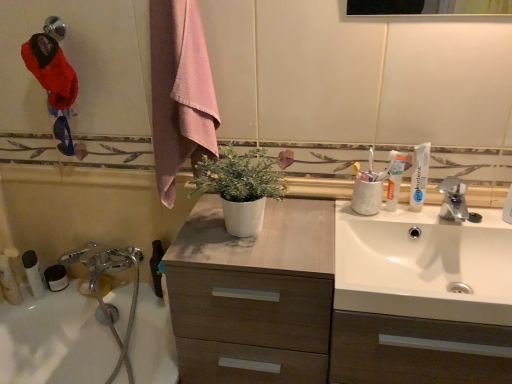
Question: Considering the relative positions of white matte tube of toothpaste at upper right, positioned as the third toothpaste in left-to-right order, and white matte toothpaste at upper right, the second toothpaste viewed from the left, in the image provided, is white matte tube of toothpaste at upper right, positioned as the third toothpaste in left-to-right order, to the right of white matte toothpaste at upper right, the second toothpaste viewed from the left, from the viewer's perspective?

Choices:
 (A) no
 (B) yes

Answer: (B)

Question: Is white matte toothpaste at upper right, the second toothpaste viewed from the left, at the back of white matte tube of toothpaste at upper right, the first toothpaste when ordered from right to left?

Choices:
 (A) no
 (B) yes

Answer: (A)

Question: From the image's perspective, is white matte tube of toothpaste at upper right, positioned as the third toothpaste in left-to-right order, under white matte toothpaste at upper right, the second toothpaste viewed from the right?

Choices:
 (A) yes
 (B) no

Answer: (B)

Question: Can you confirm if white matte tube of toothpaste at upper right, positioned as the third toothpaste in left-to-right order, is thinner than white matte toothpaste at upper right, the second toothpaste viewed from the right?

Choices:
 (A) no
 (B) yes

Answer: (A)

Question: From a real-world perspective, is white matte tube of toothpaste at upper right, the first toothpaste when ordered from right to left, over white matte toothpaste at upper right, the second toothpaste viewed from the left?

Choices:
 (A) no
 (B) yes

Answer: (B)

Question: Is white matte tube of toothpaste at upper right, the first toothpaste when ordered from right to left, outside of white matte toothpaste at upper right, the second toothpaste viewed from the right?

Choices:
 (A) no
 (B) yes

Answer: (B)

Question: Is white matte pot at center outside white plastic tube at lower left, which appears as the 1th toiletry when viewed from the left?

Choices:
 (A) no
 (B) yes

Answer: (B)

Question: Is white matte pot at center oriented away from white plastic tube at lower left, placed as the third toiletry when sorted from right to left?

Choices:
 (A) no
 (B) yes

Answer: (A)

Question: From a real-world perspective, is white matte pot at center located beneath white plastic tube at lower left, which appears as the 1th toiletry when viewed from the left?

Choices:
 (A) no
 (B) yes

Answer: (A)

Question: Is white matte pot at center shorter than white plastic tube at lower left, which appears as the 1th toiletry when viewed from the left?

Choices:
 (A) no
 (B) yes

Answer: (A)

Question: Is white matte pot at center wider than white plastic tube at lower left, which appears as the 1th toiletry when viewed from the left?

Choices:
 (A) yes
 (B) no

Answer: (A)

Question: Could you tell me if white matte pot at center is facing white plastic tube at lower left, which appears as the 1th toiletry when viewed from the left?

Choices:
 (A) yes
 (B) no

Answer: (B)

Question: From a real-world perspective, is white matte pot at center beneath white plastic tube at lower left, arranged as the 2th toiletry when viewed from the left?

Choices:
 (A) no
 (B) yes

Answer: (A)